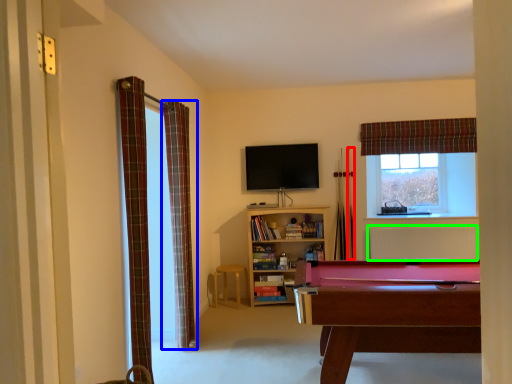
Question: Based on their relative distances, which object is nearer to cue (highlighted by a red box)? Choose from curtain (highlighted by a blue box) and radiator (highlighted by a green box).

Choices:
 (A) curtain
 (B) radiator

Answer: (B)